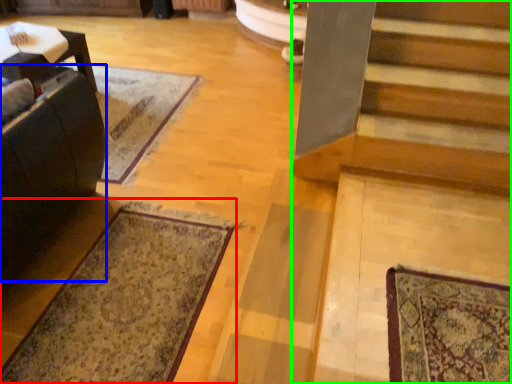
Question: Considering the real-world distances, which object is closest to mat (highlighted by a red box)? rocking chair (highlighted by a blue box) or stairs (highlighted by a green box).

Choices:
 (A) rocking chair
 (B) stairs

Answer: (A)